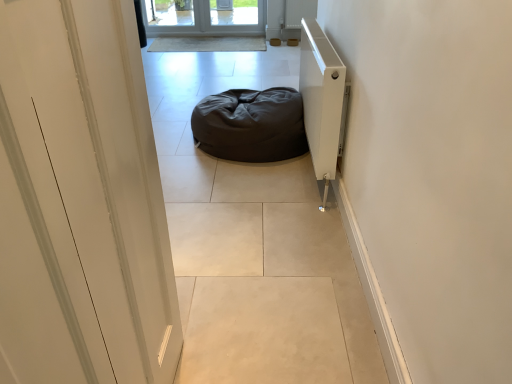
Question: Can you confirm if dark brown fabric bean bag at center is smaller than dark matte bean bag at center?

Choices:
 (A) no
 (B) yes

Answer: (B)

Question: Is dark brown fabric bean bag at center positioned beyond the bounds of dark matte bean bag at center?

Choices:
 (A) no
 (B) yes

Answer: (B)

Question: Can you confirm if dark brown fabric bean bag at center is shorter than dark matte bean bag at center?

Choices:
 (A) yes
 (B) no

Answer: (B)

Question: Does dark brown fabric bean bag at center have a lesser width compared to dark matte bean bag at center?

Choices:
 (A) yes
 (B) no

Answer: (A)

Question: Does dark brown fabric bean bag at center turn towards dark matte bean bag at center?

Choices:
 (A) no
 (B) yes

Answer: (A)

Question: From the image's perspective, is dark brown fabric bean bag at center beneath dark matte bean bag at center?

Choices:
 (A) no
 (B) yes

Answer: (B)

Question: Does white glossy door at left lie behind dark matte bean bag at center?

Choices:
 (A) no
 (B) yes

Answer: (A)

Question: Does white glossy door at left turn towards dark matte bean bag at center?

Choices:
 (A) no
 (B) yes

Answer: (A)

Question: Does white glossy door at left lie in front of dark matte bean bag at center?

Choices:
 (A) no
 (B) yes

Answer: (B)

Question: From the image's perspective, is white glossy door at left under dark matte bean bag at center?

Choices:
 (A) no
 (B) yes

Answer: (B)

Question: Are white glossy door at left and dark matte bean bag at center located far from each other?

Choices:
 (A) yes
 (B) no

Answer: (A)

Question: Is white glossy door at left to the left of dark matte bean bag at center from the viewer's perspective?

Choices:
 (A) yes
 (B) no

Answer: (B)

Question: From the image's perspective, is dark matte bean bag at center over white matte radiator at right?

Choices:
 (A) no
 (B) yes

Answer: (B)